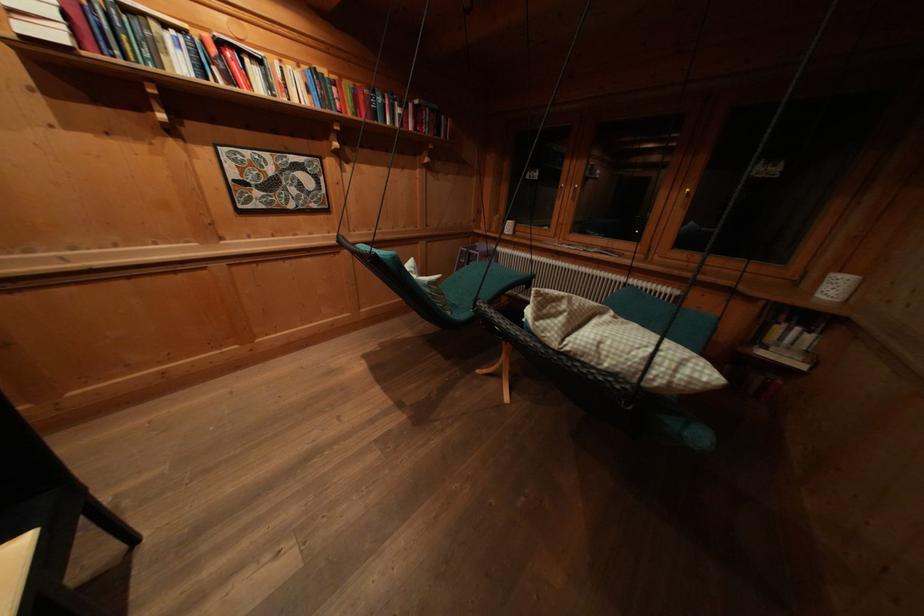
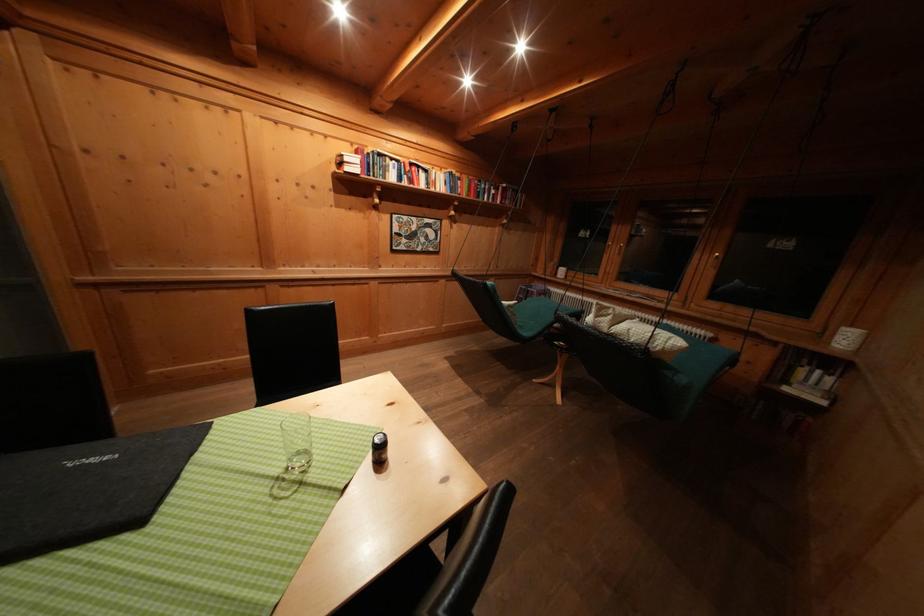
Question: I am providing you with two images of the same scene from different viewpoints. Please identify which objects are invisible in image2.

Choices:
 (A) book on shelf
 (B) white pillow
 (C) small shaker bottle
 (D) none of these

Answer: (D)